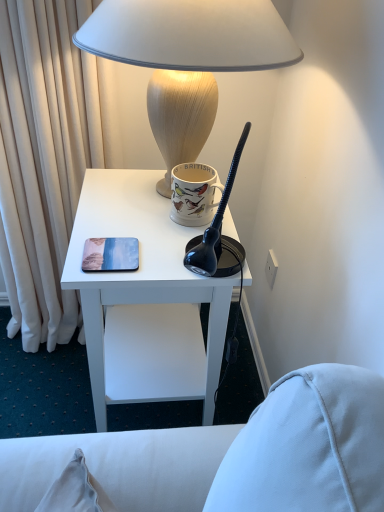
Find the location of a particular element. The image size is (384, 512). free space in front of matte ceramic mug at upper center is located at coordinates pos(178,256).